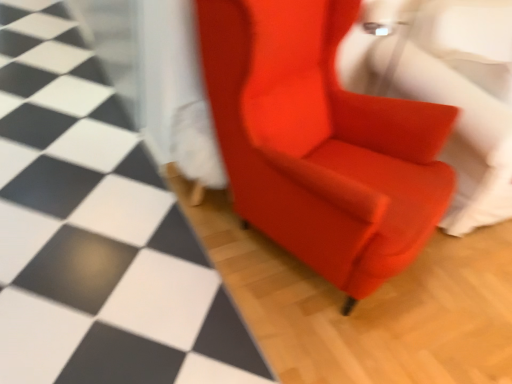
Question: Visually, is matte red armchair at center positioned to the left or to the right of satin red armchair at center?

Choices:
 (A) left
 (B) right

Answer: (A)

Question: Considering their positions, is matte red armchair at center located in front of or behind satin red armchair at center?

Choices:
 (A) behind
 (B) front

Answer: (B)

Question: Which object is the farthest from the matte red armchair at center?

Choices:
 (A) satin red armchair at center
 (B) satin red armchair at center

Answer: (B)

Question: Which object is positioned farthest from the satin red armchair at center?

Choices:
 (A) matte red armchair at center
 (B) satin red armchair at center

Answer: (A)